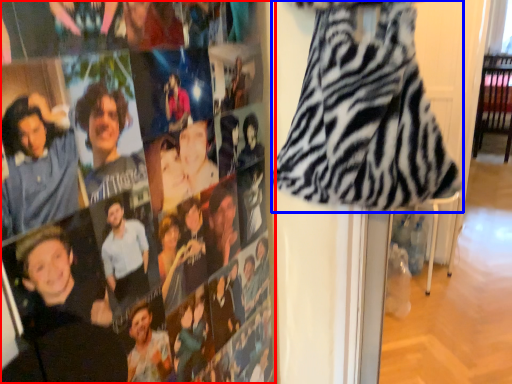
Question: Which point is closer to the camera, person (highlighted by a red box) or fancy dress (highlighted by a blue box)?

Choices:
 (A) person
 (B) fancy dress

Answer: (A)